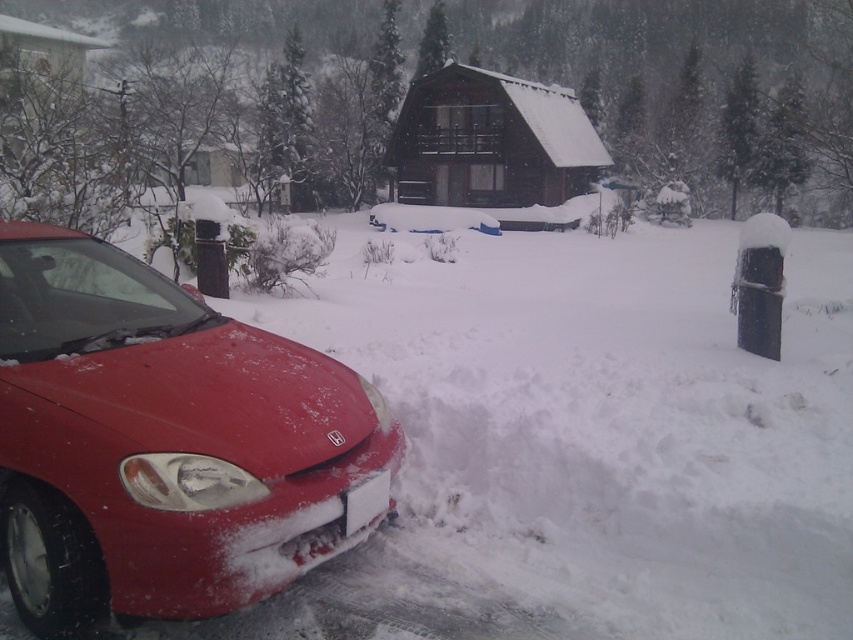
Is point (289, 550) behind point (361, 524)?

That is False.

Can you confirm if matte red car at lower left is smaller than white plastic license plate at lower center?

Actually, matte red car at lower left might be larger than white plastic license plate at lower center.

Identify the location of matte red car at lower left. (161, 442).

Which is more to the left, wooden cabin at center or smooth wooden cabin at upper center?

Positioned to the left is smooth wooden cabin at upper center.

Is wooden cabin at center to the left of smooth wooden cabin at upper center from the viewer's perspective?

No, wooden cabin at center is not to the left of smooth wooden cabin at upper center.

Identify the location of wooden cabin at center. (491, 141).

Identify the location of wooden cabin at center. (491, 141).

Is matte red car at lower left to the left of smooth wooden cabin at upper center from the viewer's perspective?

Incorrect, matte red car at lower left is not on the left side of smooth wooden cabin at upper center.

Between point (195, 444) and point (33, 33), which one is positioned behind?

Positioned behind is point (33, 33).

Is point (78, 444) positioned behind point (49, 60)?

No.

At what (x,y) coordinates should I click in order to perform the action: click on matte red car at lower left. Please return your answer as a coordinate pair (x, y). Looking at the image, I should click on (161, 442).